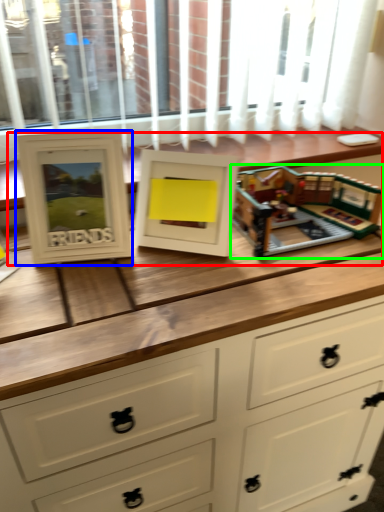
Question: Based on their relative distances, which object is farther from buffet (highlighted by a red box)? Choose from picture frame (highlighted by a blue box) and toy (highlighted by a green box).

Choices:
 (A) picture frame
 (B) toy

Answer: (A)